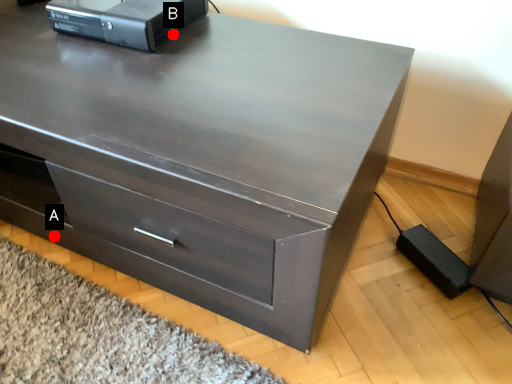
Question: Two points are circled on the image, labeled by A and B beside each circle. Which point is closer to the camera?

Choices:
 (A) A is closer
 (B) B is closer

Answer: (B)